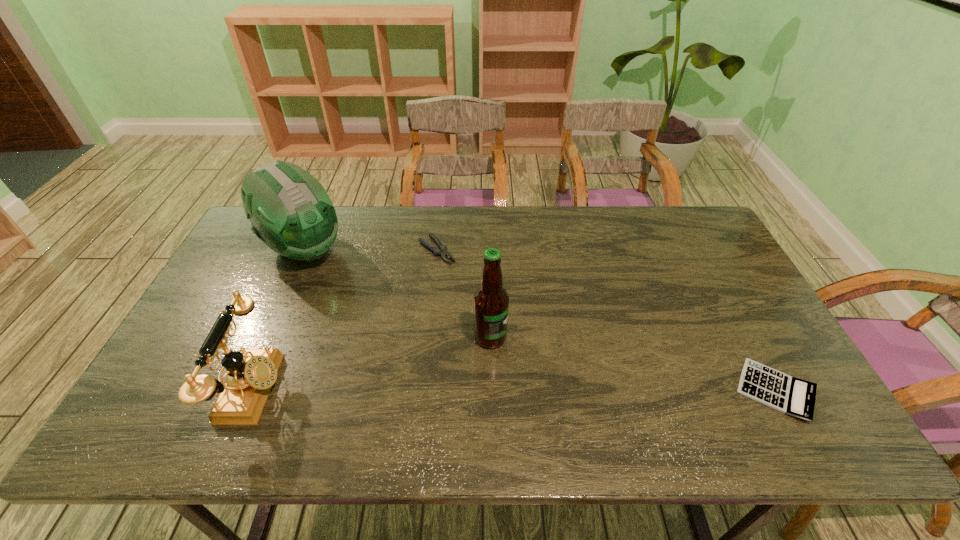
At what (x,y) coordinates should I click in order to perform the action: click on the third shortest object. Please return your answer as a coordinate pair (x, y). The width and height of the screenshot is (960, 540). Looking at the image, I should click on (251, 373).

Find the location of `calculator`. calculator is located at coordinates (795, 397).

The image size is (960, 540). Find the location of `beer bottle`. beer bottle is located at coordinates (x=491, y=301).

Where is `football helmet`? This screenshot has width=960, height=540. football helmet is located at coordinates (290, 211).

Locate an element on the screen. The height and width of the screenshot is (540, 960). the third object from left to right is located at coordinates (441, 251).

Where is `free space located on the dial of the third tallest object`? The image size is (960, 540). free space located on the dial of the third tallest object is located at coordinates (304, 390).

This screenshot has width=960, height=540. In order to click on vacant space located 0.400m on the back of the rightmost object in this screenshot , I will do `click(702, 257)`.

This screenshot has height=540, width=960. I want to click on blank space located on the label of the second object from right to left, so click(x=546, y=369).

At what (x,y) coordinates should I click in order to perform the action: click on free space located on the label of the second object from right to left. Please return your answer as a coordinate pair (x, y). This screenshot has height=540, width=960. Looking at the image, I should click on (526, 357).

This screenshot has width=960, height=540. I want to click on free space located 0.220m on the label of the second object from right to left, so click(579, 388).